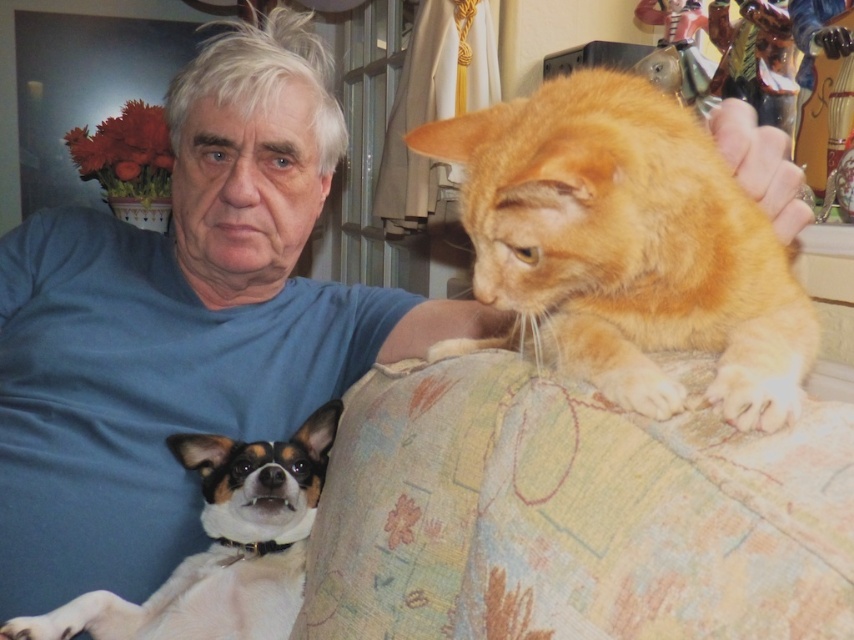
You are a photographer setting up a shot of the blue cotton shirt at upper left and the orange fur cat at upper right. Which object should you focus on first if you want to capture both in the same frame without moving the camera?

The blue cotton shirt at upper left should be focused on first because it is larger than the orange fur cat at upper right, ensuring it fills the frame appropriately while still capturing the cat in the shot.

You are a photographer setting up a camera to take a portrait of the orange fur cat at upper right and the white fur dog at lower left. The camera has a height adjustment feature. To ensure both subjects are in focus, you need to know which one is taller. Which animal is taller?

The orange fur cat at upper right is taller than the white fur dog at lower left, so you should adjust the camera height to focus on the orange fur cat at upper right first.